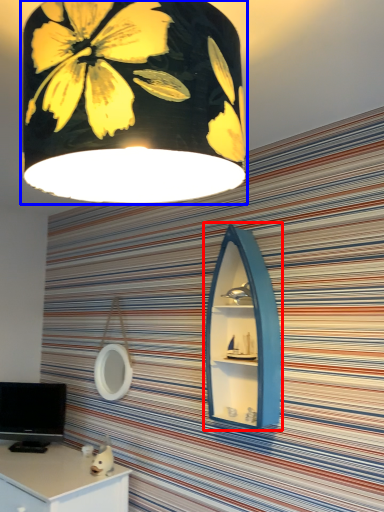
Question: Which of the following is the closest to the observer, medicine cabinet (highlighted by a red box) or lamp (highlighted by a blue box)?

Choices:
 (A) medicine cabinet
 (B) lamp

Answer: (B)